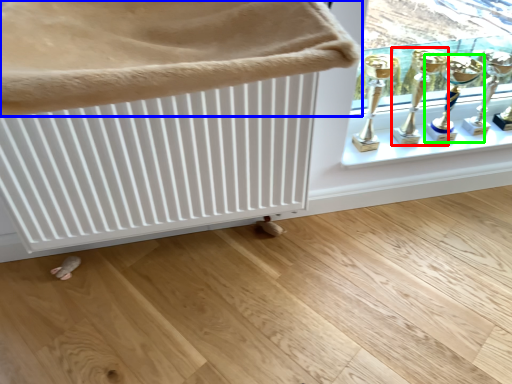
Question: Estimate the real-world distances between objects in this image. Which object is farther from trophy (highlighted by a red box), furniture (highlighted by a blue box) or candle holder (highlighted by a green box)?

Choices:
 (A) furniture
 (B) candle holder

Answer: (A)